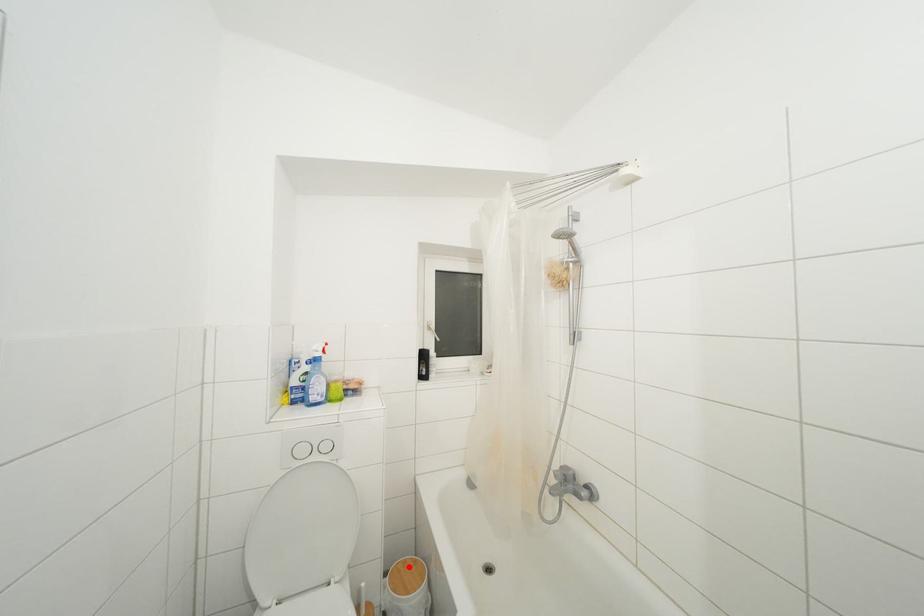
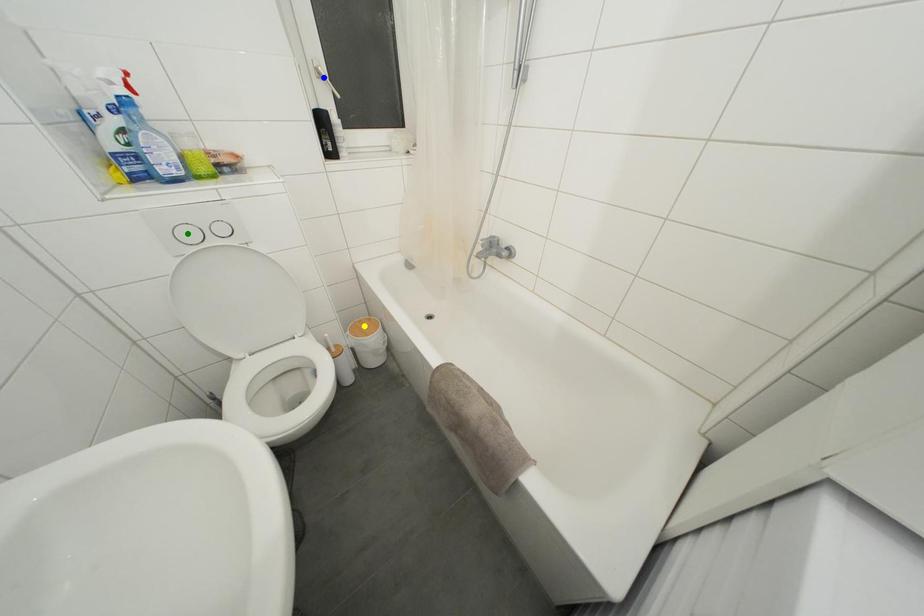
Question: I am providing you with two images of the same scene from different viewpoints. A red point is marked on the first image. You are given multiple points on the second image. Can you choose the point in image 2 that corresponds to the point in image 1?

Choices:
 (A) yellow point
 (B) green point
 (C) blue point

Answer: (A)